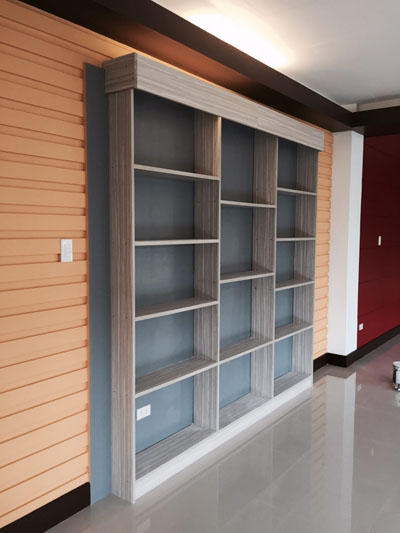
You are a GUI agent. You are given a task and a screenshot of the screen. Output one action in this format:
    pyautogui.click(x=<x>, y=<y>)
    Task: Click on the light switches
    The image size is (400, 533).
    Given the screenshot: What is the action you would take?
    click(68, 246), click(379, 242)